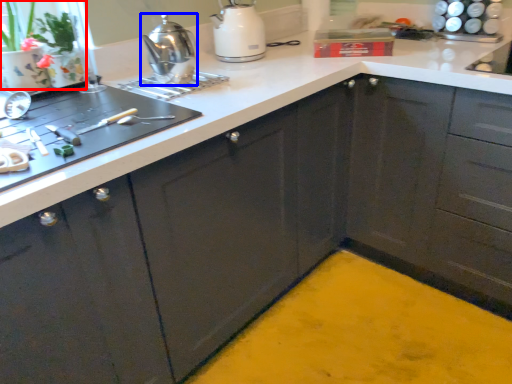
Question: Which object appears closest to the camera in this image, plant (highlighted by a red box) or kitchen appliance (highlighted by a blue box)?

Choices:
 (A) plant
 (B) kitchen appliance

Answer: (A)